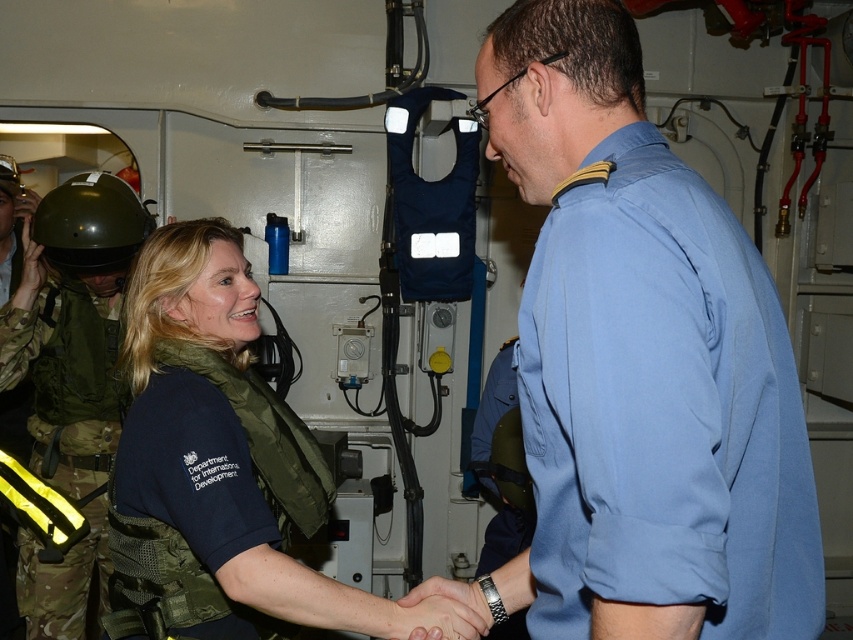
You are a safety inspector assessing equipment in this scene. You need to determine which item is wider between the green matte helmet at left and the dark blue fabric vest at center. Which one is wider?

The green matte helmet at left is wider than the dark blue fabric vest at center according to the description provided.

You are a safety inspector on a ship and need to ensure all equipment is properly placed. The green matte helmet at left and the dark blue fabric vest at center are part of the safety gear. According to the safety protocol, helmets must be stored above vests. Is the current arrangement compliant with the protocol?

The green matte helmet at left is located above the dark blue fabric vest at center, so the current arrangement is compliant with the safety protocol.